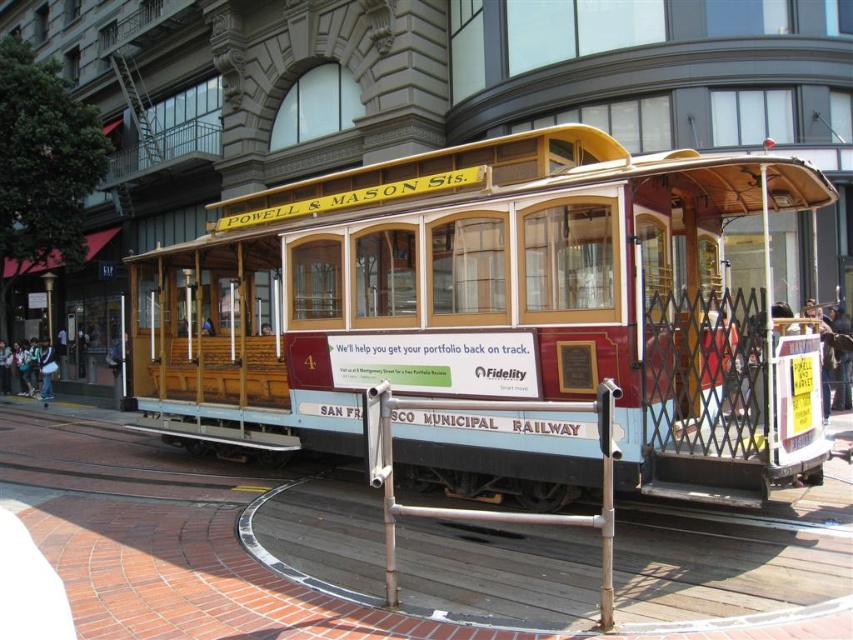
Is the position of wooden cable car at center more distant than that of silver metallic rail at lower center?

Yes, it is behind silver metallic rail at lower center.

Looking at this image, is wooden cable car at center closer to the viewer compared to silver metallic rail at lower center?

No, it is not.

Does point (463, 314) come in front of point (517, 520)?

No, it is behind (517, 520).

The height and width of the screenshot is (640, 853). What are the coordinates of `wooden cable car at center` in the screenshot? It's located at (496, 307).